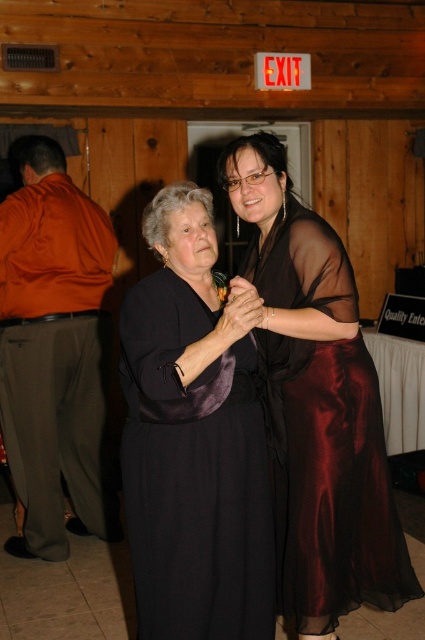
You are a photographer at a formal event. You need to capture a photo of the two women wearing the satin black dress at center and the sheer dark brown dress at center. Which dress will have a hemline that reaches lower on the body?

The sheer dark brown dress at center has a lower hemline because it is longer than the satin black dress at center.

You are a photographer trying to capture a clear shot of the sheer dark brown dress at center. The camera you are using has a minimum focus distance of 6 feet. Can you focus on the dress without moving closer?

The sheer dark brown dress at center is 6.34 feet from the camera. Since the minimum focus distance is 6 feet, the camera can focus on the dress as it is within the required range.

You are a photographer at a formal event and need to position two women wearing the satin black dress at center and the sheer dark brown dress at center for a photo. Which dress is on the left side?

The satin black dress at center is positioned on the left side of the sheer dark brown dress at center.